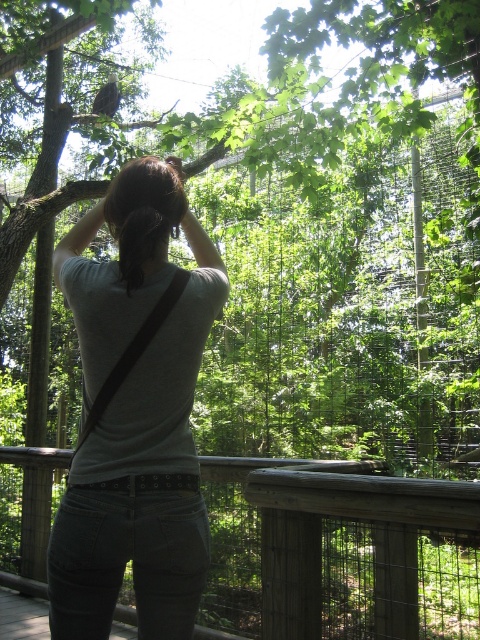
Question: From the image, what is the correct spatial relationship of gray matte shirt at center in relation to brown hair at upper center?

Choices:
 (A) above
 (B) below

Answer: (B)

Question: Which point is farther from the camera taking this photo?

Choices:
 (A) (131, 230)
 (B) (142, 378)

Answer: (B)

Question: Does gray matte shirt at center have a larger size compared to brown hair at upper center?

Choices:
 (A) no
 (B) yes

Answer: (B)

Question: Which point is closer to the camera taking this photo?

Choices:
 (A) (52, 260)
 (B) (137, 275)

Answer: (B)

Question: Does gray matte shirt at center lie in front of brown hair at upper center?

Choices:
 (A) yes
 (B) no

Answer: (B)